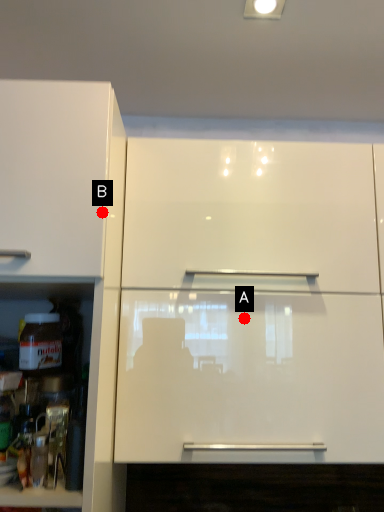
Question: Two points are circled on the image, labeled by A and B beside each circle. Which of the following is the closest to the observer?

Choices:
 (A) A is closer
 (B) B is closer

Answer: (B)